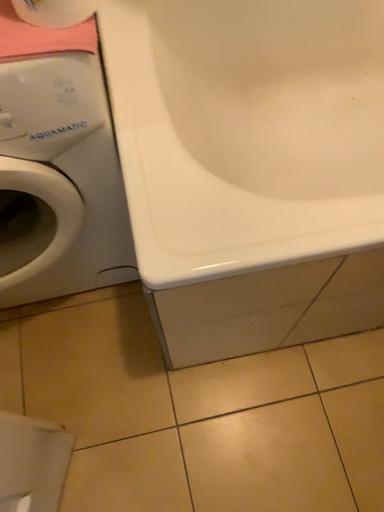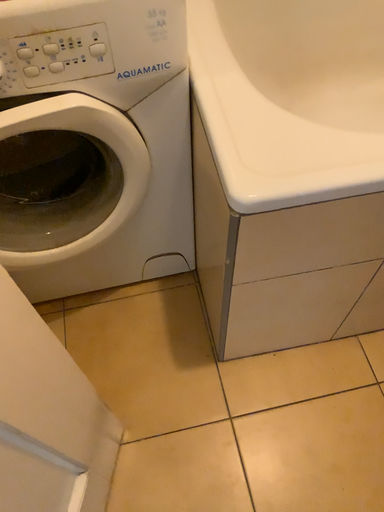
Question: How did the camera likely rotate when shooting the video?

Choices:
 (A) rotated upward
 (B) rotated downward

Answer: (A)